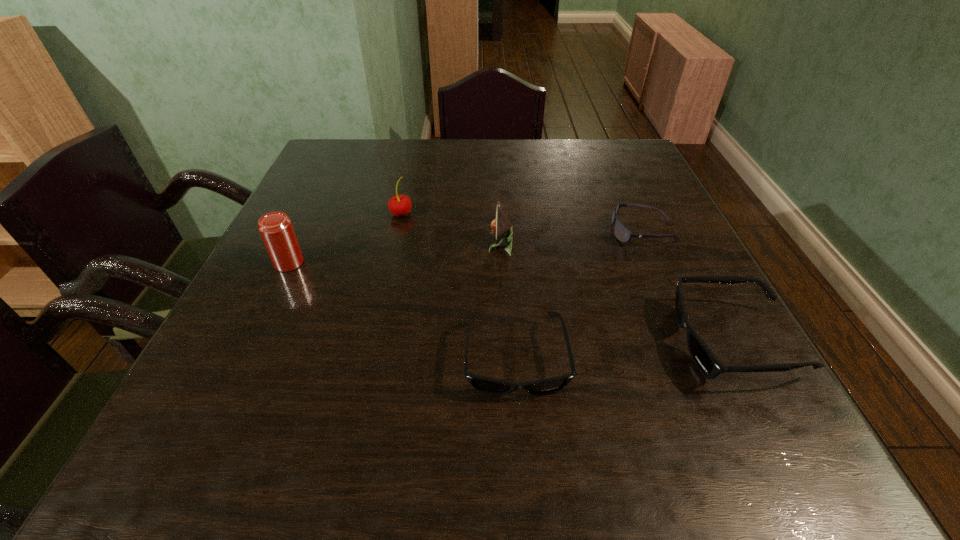
Where is `vacant area that lies between the fourth tallest object and the avocado`? The width and height of the screenshot is (960, 540). vacant area that lies between the fourth tallest object and the avocado is located at coordinates (616, 294).

Identify the location of vacant space that is in between the avocado and the leftmost object. The image size is (960, 540). (395, 254).

The image size is (960, 540). I want to click on vacant area between the fourth tallest object and the leftmost sunglasses, so click(624, 350).

At what (x,y) coordinates should I click in order to perform the action: click on unoccupied position between the fifth object from right to left and the third shortest object. Please return your answer as a coordinate pair (x, y). Looking at the image, I should click on (566, 278).

The width and height of the screenshot is (960, 540). What are the coordinates of `unoccupied area between the shortest sunglasses and the leftmost object` in the screenshot? It's located at (466, 247).

Identify the location of free space between the tallest sunglasses and the shortest object. Image resolution: width=960 pixels, height=540 pixels. (687, 287).

You are a GUI agent. You are given a task and a screenshot of the screen. Output one action in this format:
    pyautogui.click(x=<x>, y=<y>)
    Task: Click on the free space between the leftmost object and the avocado
    
    Given the screenshot: What is the action you would take?
    pyautogui.click(x=395, y=254)

You are a GUI agent. You are given a task and a screenshot of the screen. Output one action in this format:
    pyautogui.click(x=<x>, y=<y>)
    Task: Click on the object that is the fifth closest one to the fourth tallest object
    The width and height of the screenshot is (960, 540).
    Given the screenshot: What is the action you would take?
    (276, 229)

Identify which object is the closest to the avocado. Please provide its 2D coordinates. Your answer should be formatted as a tuple, i.e. [(x, y)], where the tuple contains the x and y coordinates of a point satisfying the conditions above.

[(484, 384)]

This screenshot has width=960, height=540. Find the location of `sunglasses that is the closest to the cherry`. sunglasses that is the closest to the cherry is located at coordinates (484, 384).